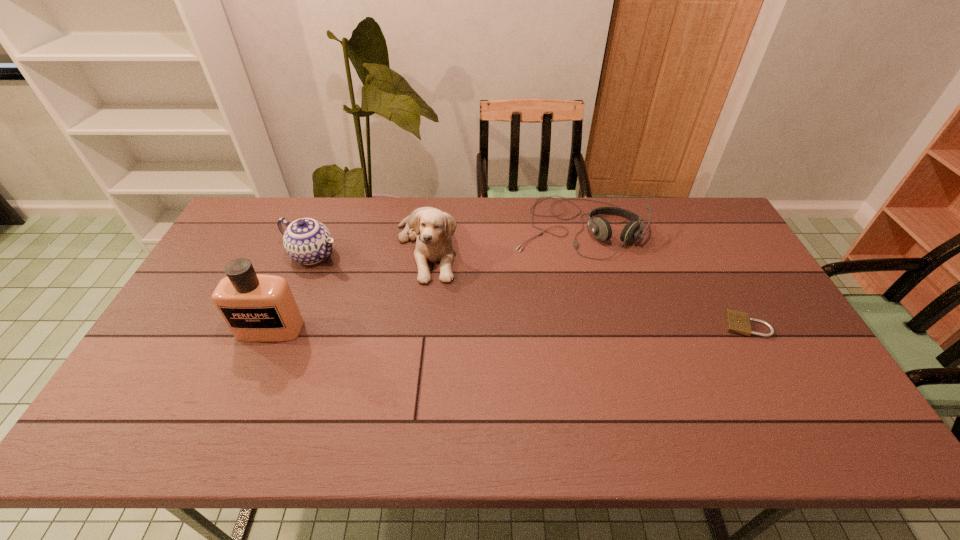
Where is `vacant space on the desktop that is between the tallest object and the shortest object and is positioned on the front-facing side of the puppy`? vacant space on the desktop that is between the tallest object and the shortest object and is positioned on the front-facing side of the puppy is located at coordinates (459, 328).

What are the coordinates of `free spot on the desktop that is between the tallest object and the rightmost object and is positioned on the outer surface of the second object from right to left` in the screenshot? It's located at [569, 327].

At what (x,y) coordinates should I click in order to perform the action: click on vacant space on the desktop that is between the tallest object and the shortest object and is positioned at the spout of the chinaware. Please return your answer as a coordinate pair (x, y). The height and width of the screenshot is (540, 960). Looking at the image, I should click on (475, 328).